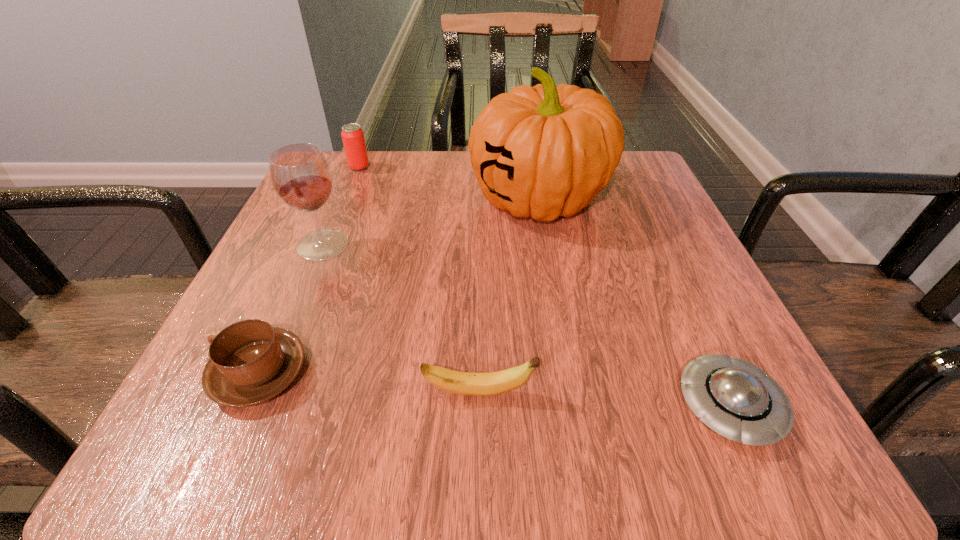
Identify the location of pumpkin. (544, 151).

The height and width of the screenshot is (540, 960). What are the coordinates of `wineglass` in the screenshot? It's located at (301, 176).

The image size is (960, 540). I want to click on the fourth shortest object, so click(x=353, y=139).

Where is `banana`? banana is located at coordinates (464, 383).

This screenshot has width=960, height=540. Find the location of `cappuccino`. cappuccino is located at coordinates (250, 362).

The height and width of the screenshot is (540, 960). In order to click on saucer in this screenshot , I will do `click(738, 400)`.

Identify the location of free space located on the surface of the pumpkin. This screenshot has height=540, width=960. (345, 199).

At what (x,y) coordinates should I click in order to perform the action: click on free space located on the surface of the pumpkin. Please return your answer as a coordinate pair (x, y). Looking at the image, I should click on (365, 199).

Identify the location of free location located 0.050m on the surface of the pumpkin. (444, 199).

The height and width of the screenshot is (540, 960). In order to click on free spot located 0.400m on the right of the wineglass in this screenshot , I will do `click(575, 245)`.